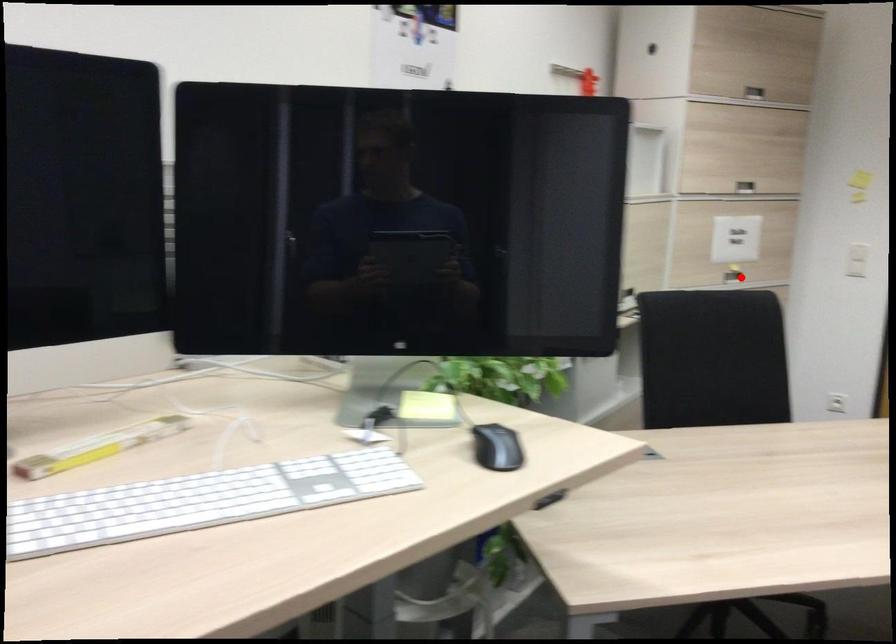
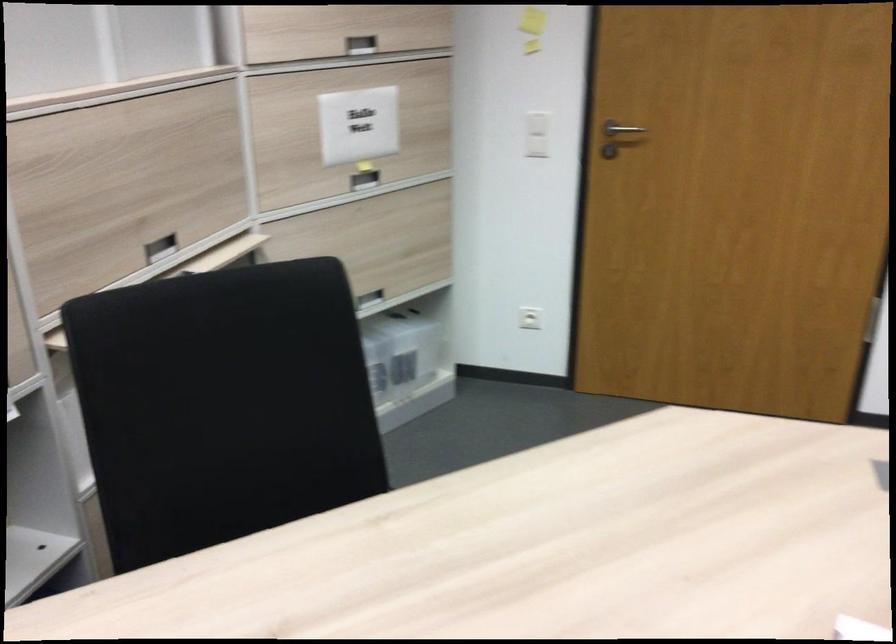
Question: A red point is marked in image1. In image2, is the corresponding 3D point closer to the camera or farther? Reply with the corresponding letter.

Choices:
 (A) The corresponding 3D point is closer.
 (B) The corresponding 3D point is farther.

Answer: (A)